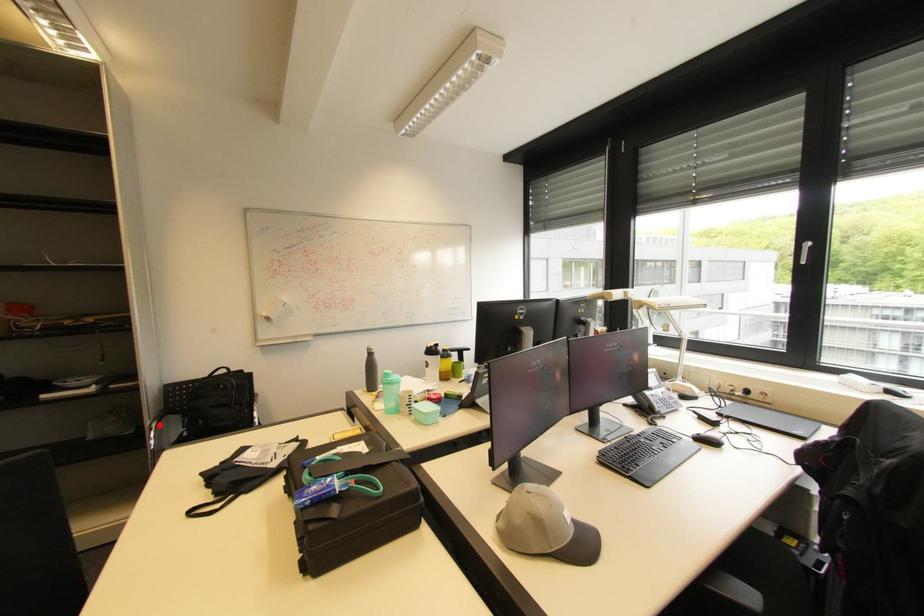
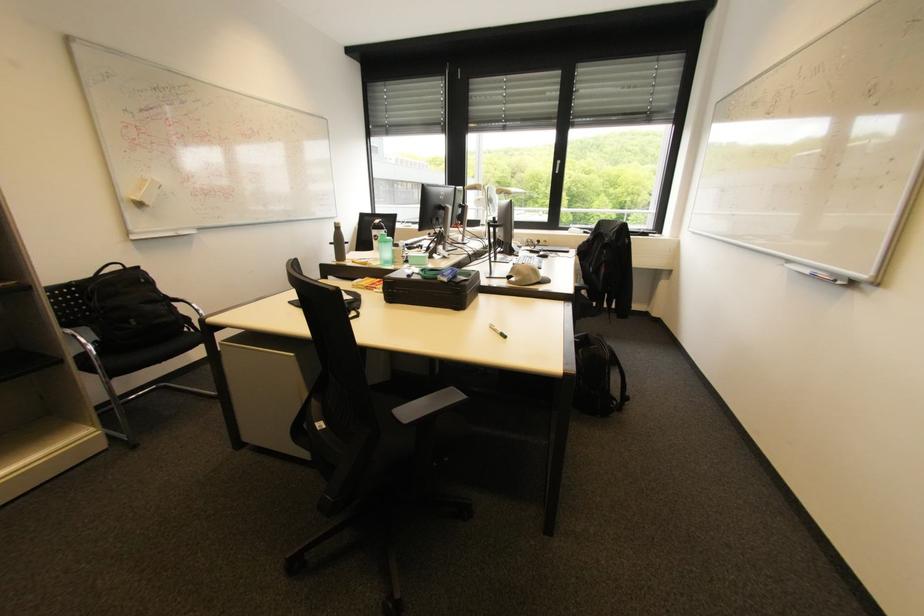
Find the pixel in the second image that matches the highlighted location in the first image.

(74, 331)